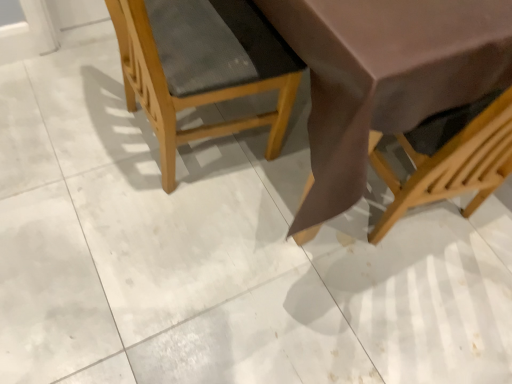
Question: Is wooden textured chair at center, the second chair when ordered from right to left, to the left or to the right of matte brown chair at right, the first chair viewed from the right, in the image?

Choices:
 (A) right
 (B) left

Answer: (B)

Question: Considering their positions, is wooden textured chair at center, the second chair when ordered from right to left, located in front of or behind matte brown chair at right, which is the 2th chair from left to right?

Choices:
 (A) behind
 (B) front

Answer: (A)

Question: From a real-world perspective, relative to matte brown chair at right, the first chair viewed from the right, is wooden textured chair at center, the second chair when ordered from right to left, vertically above or below?

Choices:
 (A) above
 (B) below

Answer: (B)

Question: From a real-world perspective, is matte brown chair at right, the first chair viewed from the right, above or below wooden textured chair at center, the first chair from the left?

Choices:
 (A) above
 (B) below

Answer: (A)

Question: Relative to wooden textured chair at center, the first chair from the left, is matte brown chair at right, which is the 2th chair from left to right, in front or behind?

Choices:
 (A) front
 (B) behind

Answer: (A)

Question: Is matte brown chair at right, the first chair viewed from the right, spatially inside wooden textured chair at center, the second chair when ordered from right to left, or outside of it?

Choices:
 (A) outside
 (B) inside

Answer: (A)

Question: Visually, is matte brown chair at right, which is the 2th chair from left to right, positioned to the left or to the right of wooden textured chair at center, the first chair from the left?

Choices:
 (A) right
 (B) left

Answer: (A)